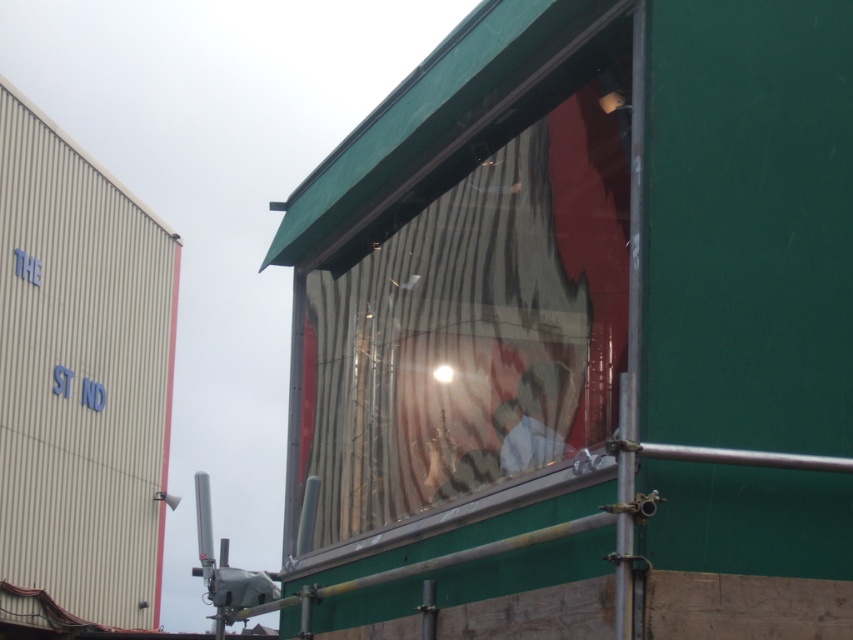
Who is lower down, transparent glass window at center or white fabric at center?

Positioned lower is white fabric at center.

Find the location of a particular element. The width and height of the screenshot is (853, 640). transparent glass window at center is located at coordinates (460, 264).

This screenshot has width=853, height=640. Identify the location of transparent glass window at center. [460, 264].